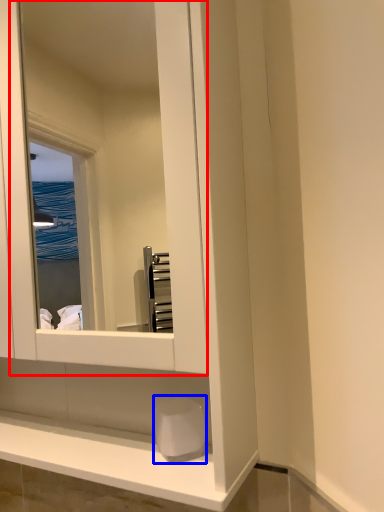
Question: Among these objects, which one is farthest to the camera, mirror (highlighted by a red box) or soap (highlighted by a blue box)?

Choices:
 (A) mirror
 (B) soap

Answer: (B)